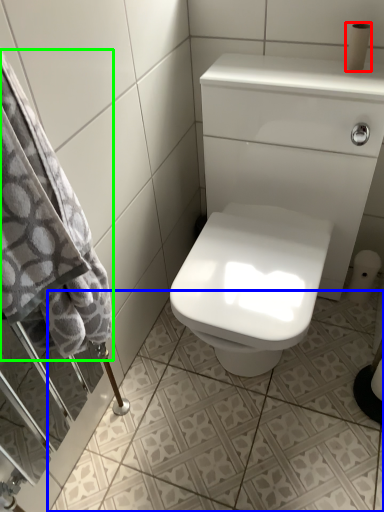
Question: Which object is the farthest from toilet paper (highlighted by a red box)? Choose among these: ceramic tile (highlighted by a blue box) or bath towel (highlighted by a green box).

Choices:
 (A) ceramic tile
 (B) bath towel

Answer: (A)